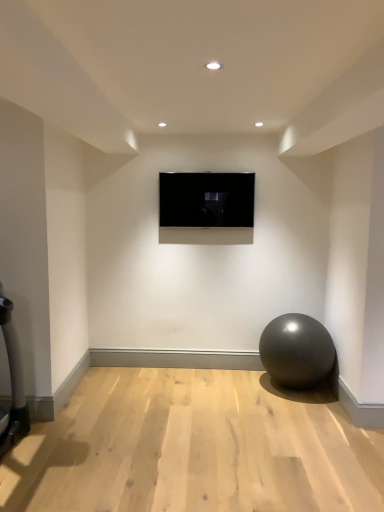
Question: Is matte gray ball at lower right in front of or behind matte black screen at center in the image?

Choices:
 (A) behind
 (B) front

Answer: (B)

Question: Considering the positions of matte gray ball at lower right and matte black screen at center in the image, is matte gray ball at lower right bigger or smaller than matte black screen at center?

Choices:
 (A) small
 (B) big

Answer: (B)

Question: Considering the relative positions of matte gray ball at lower right and matte black screen at center in the image provided, is matte gray ball at lower right to the left or to the right of matte black screen at center?

Choices:
 (A) left
 (B) right

Answer: (B)

Question: Is matte black screen at center taller or shorter than matte gray ball at lower right?

Choices:
 (A) tall
 (B) short

Answer: (B)

Question: From the image's perspective, is matte black screen at center above or below matte gray ball at lower right?

Choices:
 (A) below
 (B) above

Answer: (B)

Question: Looking at their shapes, would you say matte black screen at center is wider or thinner than matte gray ball at lower right?

Choices:
 (A) thin
 (B) wide

Answer: (A)

Question: Looking at the image, does matte black screen at center seem bigger or smaller compared to matte gray ball at lower right?

Choices:
 (A) small
 (B) big

Answer: (A)